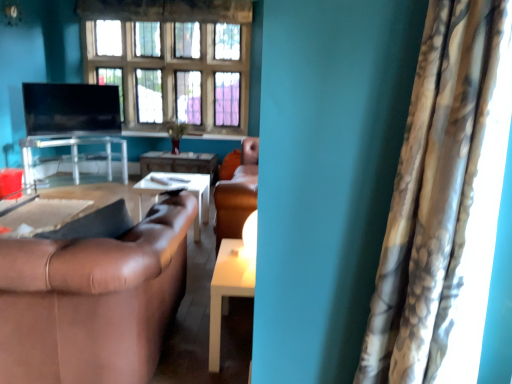
Question: Is point (0, 274) closer or farther from the camera than point (221, 306)?

Choices:
 (A) farther
 (B) closer

Answer: (B)

Question: From their relative heights in the image, would you say brown leather couch at lower left is taller or shorter than white glossy table at center, placed as the 3th table when sorted from back to front?

Choices:
 (A) short
 (B) tall

Answer: (B)

Question: Estimate the real-world distances between objects in this image. Which object is closer to the brown leather couch at lower left?

Choices:
 (A) camouflage fabric curtain at right
 (B) wooden glossy table at center, arranged as the third table when viewed from the front
 (C) wooden frame window at upper center
 (D) matte black tv at upper left
 (E) clear glass table at center, arranged as the 1th table when viewed from the top

Answer: (A)

Question: Estimate the real-world distances between objects in this image. Which object is closer to the matte black tv at upper left?

Choices:
 (A) brown leather couch at lower left
 (B) clear glass table at center, arranged as the 1th table when viewed from the top
 (C) wooden frame window at upper center
 (D) camouflage fabric curtain at right
 (E) wooden glossy table at center, the 2th table when ordered from left to right

Answer: (B)